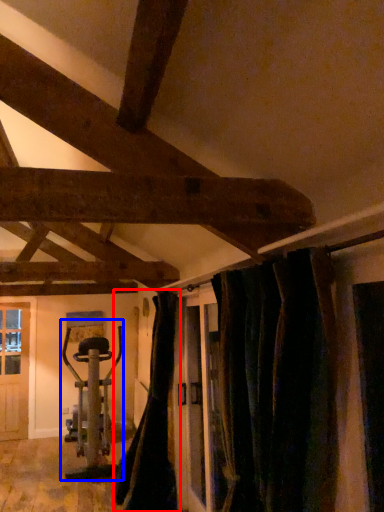
Question: Which of the following is the farthest to the observer, curtain (highlighted by a red box) or sport equipment (highlighted by a blue box)?

Choices:
 (A) curtain
 (B) sport equipment

Answer: (B)